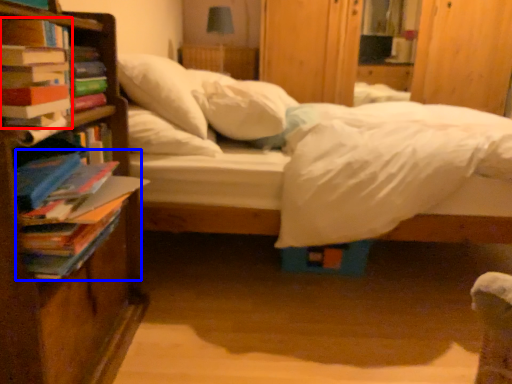
Question: Which of the following is the farthest to the observer, book (highlighted by a red box) or book (highlighted by a blue box)?

Choices:
 (A) book
 (B) book

Answer: (A)